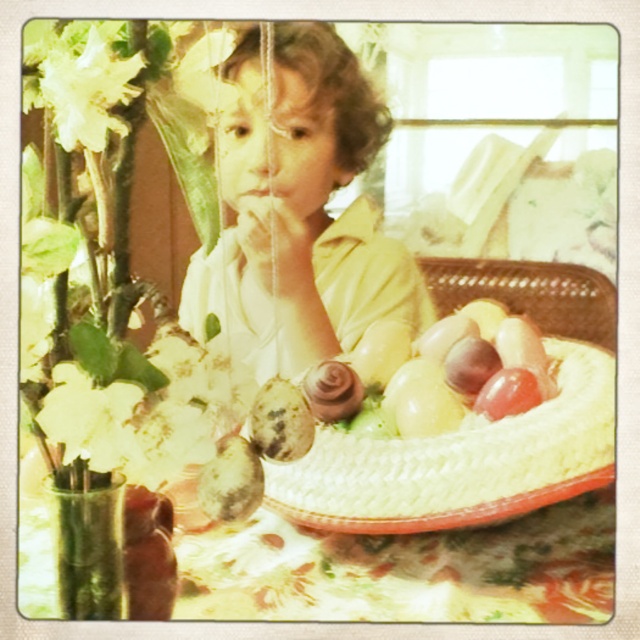
Question: Is matte yellow shirt at center further to camera compared to white matte flower at upper left?

Choices:
 (A) no
 (B) yes

Answer: (B)

Question: Which point appears closest to the camera in this image?

Choices:
 (A) (54, 417)
 (B) (44, 51)
 (C) (276, 65)

Answer: (A)

Question: Which of the following is the closest to the observer?

Choices:
 (A) white matte flower at upper left
 (B) white matte flower at left

Answer: (A)

Question: Estimate the real-world distances between objects in this image. Which object is closer to the matte yellow shirt at center?

Choices:
 (A) white matte flower at upper left
 (B) white matte flower at left

Answer: (A)

Question: Can you confirm if matte yellow shirt at center is smaller than white matte flower at left?

Choices:
 (A) yes
 (B) no

Answer: (B)

Question: Can you confirm if matte yellow shirt at center is positioned to the left of white matte flower at upper left?

Choices:
 (A) no
 (B) yes

Answer: (A)